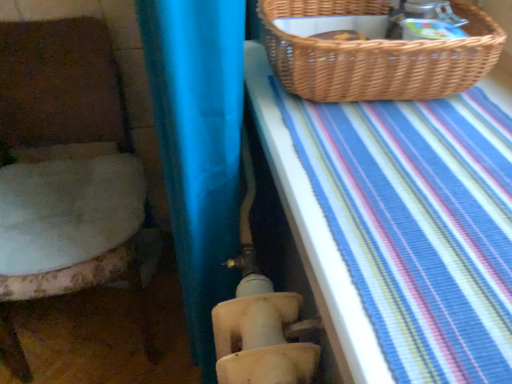
Question: Is woven brown picnic basket at upper right looking in the opposite direction of blue striped fabric at upper right?

Choices:
 (A) yes
 (B) no

Answer: (B)

Question: From a real-world perspective, is woven brown picnic basket at upper right physically below blue striped fabric at upper right?

Choices:
 (A) yes
 (B) no

Answer: (B)

Question: Would you say woven brown picnic basket at upper right is outside blue striped fabric at upper right?

Choices:
 (A) no
 (B) yes

Answer: (B)

Question: Would you say woven brown picnic basket at upper right contains blue striped fabric at upper right?

Choices:
 (A) yes
 (B) no

Answer: (B)

Question: From a real-world perspective, is woven brown picnic basket at upper right over blue striped fabric at upper right?

Choices:
 (A) yes
 (B) no

Answer: (A)

Question: Is woven brown picnic basket at upper right taller than blue striped fabric at upper right?

Choices:
 (A) yes
 (B) no

Answer: (A)

Question: Is blue striped fabric at upper right turned away from woven brown picnic basket at upper right?

Choices:
 (A) no
 (B) yes

Answer: (A)

Question: Does blue striped fabric at upper right contain woven brown picnic basket at upper right?

Choices:
 (A) no
 (B) yes

Answer: (A)

Question: Does blue striped fabric at upper right have a greater width compared to woven brown picnic basket at upper right?

Choices:
 (A) no
 (B) yes

Answer: (B)

Question: From a real-world perspective, is blue striped fabric at upper right on top of woven brown picnic basket at upper right?

Choices:
 (A) no
 (B) yes

Answer: (A)

Question: Is blue striped fabric at upper right taller than woven brown picnic basket at upper right?

Choices:
 (A) no
 (B) yes

Answer: (A)

Question: From the image's perspective, is blue striped fabric at upper right over woven brown picnic basket at upper right?

Choices:
 (A) no
 (B) yes

Answer: (A)

Question: From a real-world perspective, is fluffy white cushion at left positioned under woven brown picnic basket at upper right based on gravity?

Choices:
 (A) no
 (B) yes

Answer: (B)